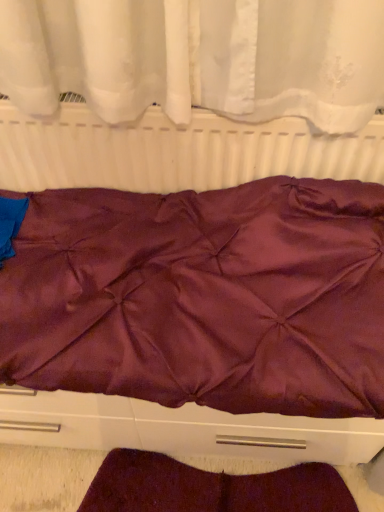
Question: Is matte white radiator at center bigger than satin purple bedspread at center?

Choices:
 (A) yes
 (B) no

Answer: (B)

Question: Is matte white radiator at center looking in the opposite direction of satin purple bedspread at center?

Choices:
 (A) no
 (B) yes

Answer: (A)

Question: Are matte white radiator at center and satin purple bedspread at center making contact?

Choices:
 (A) yes
 (B) no

Answer: (B)

Question: Can satin purple bedspread at center be found inside matte white radiator at center?

Choices:
 (A) no
 (B) yes

Answer: (A)

Question: Can you confirm if matte white radiator at center is positioned to the right of satin purple bedspread at center?

Choices:
 (A) yes
 (B) no

Answer: (A)

Question: In the image, is matte white radiator at center on the left side or the right side of satin purple bedspread at center?

Choices:
 (A) right
 (B) left

Answer: (A)

Question: Choose the correct answer: Is matte white radiator at center inside satin purple bedspread at center or outside it?

Choices:
 (A) inside
 (B) outside

Answer: (B)

Question: Based on their sizes in the image, would you say matte white radiator at center is bigger or smaller than satin purple bedspread at center?

Choices:
 (A) big
 (B) small

Answer: (B)

Question: Considering the positions of matte white radiator at center and satin purple bedspread at center in the image, is matte white radiator at center taller or shorter than satin purple bedspread at center?

Choices:
 (A) short
 (B) tall

Answer: (A)

Question: Considering the positions of matte white radiator at center and burgundy satin blanket at lower center in the image, is matte white radiator at center wider or thinner than burgundy satin blanket at lower center?

Choices:
 (A) thin
 (B) wide

Answer: (A)

Question: From a real-world perspective, is matte white radiator at center physically located above or below burgundy satin blanket at lower center?

Choices:
 (A) above
 (B) below

Answer: (A)

Question: Is matte white radiator at center situated inside burgundy satin blanket at lower center or outside?

Choices:
 (A) outside
 (B) inside

Answer: (A)

Question: Based on their sizes in the image, would you say matte white radiator at center is bigger or smaller than burgundy satin blanket at lower center?

Choices:
 (A) small
 (B) big

Answer: (B)

Question: Is point (369, 295) closer or farther from the camera than point (226, 489)?

Choices:
 (A) farther
 (B) closer

Answer: (B)

Question: Is satin purple bedspread at center to the left or to the right of burgundy satin blanket at lower center in the image?

Choices:
 (A) left
 (B) right

Answer: (A)